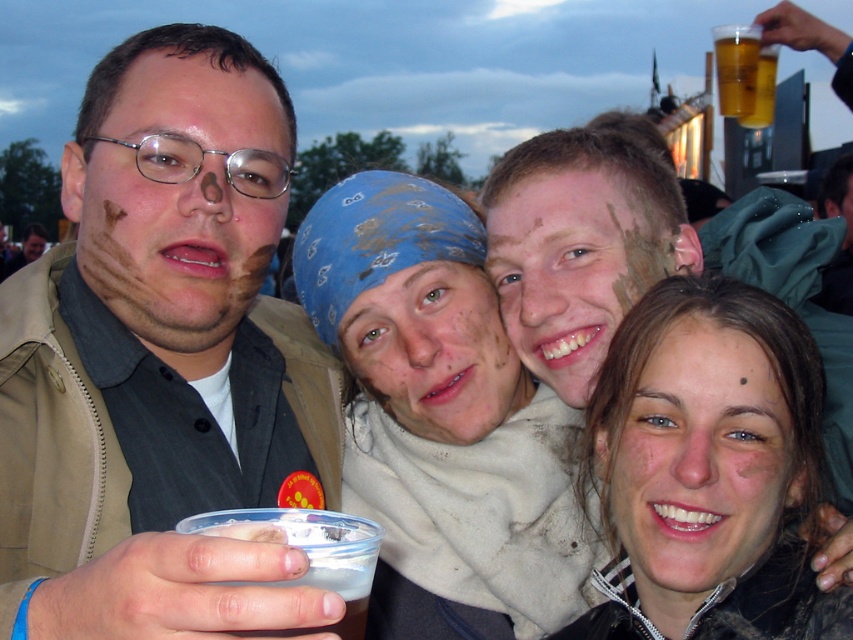
Looking at this image, you are a photographer at this muddy event and want to take a photo of the two people with matte brown face paint at center and matte brown face at center. Which one will appear taller in the photo?

The matte brown face paint at center will appear taller in the photo because it has a greater height compared to the matte brown face at center.

Looking at this image, you are a photographer trying to capture a photo of the matte black jacket at lower right and the matte black shirt at left. Which object should you focus on first if you want to ensure both are in focus without adjusting the camera settings?

The matte black jacket at lower right is below the matte black shirt at left. Since the matte black shirt at left is higher up, it would be closer to the camera. Focus on the matte black shirt at left first to ensure both are in focus.